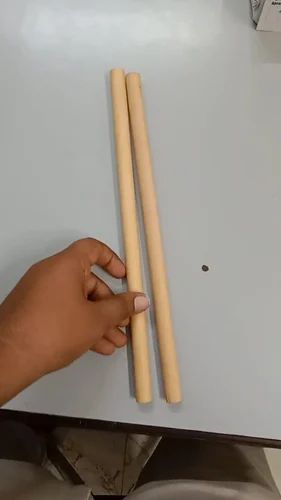
The height and width of the screenshot is (500, 281). Identify the location of white surface. (186, 72).